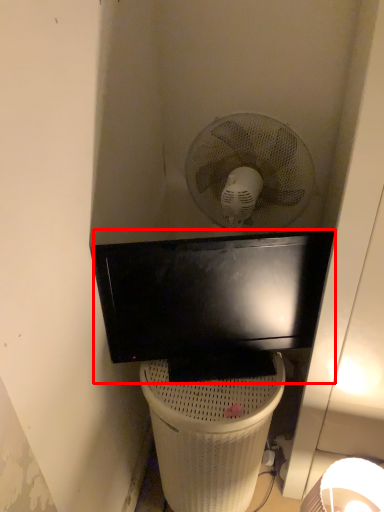
Question: From the image's perspective, where is television (annotated by the red box) located relative to trash bin/can?

Choices:
 (A) above
 (B) below

Answer: (A)